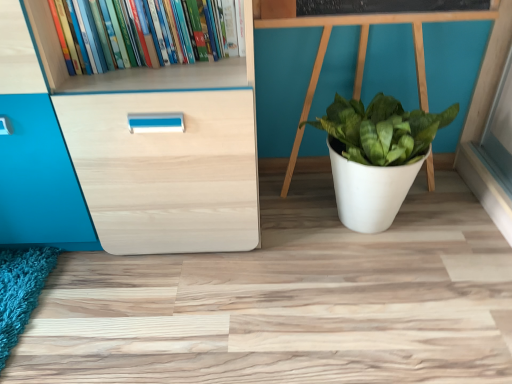
Question: Based on their positions, is white matte pot at center located to the left or right of hardcover books at upper left?

Choices:
 (A) left
 (B) right

Answer: (B)

Question: Considering the positions of white matte pot at center and hardcover books at upper left in the image, is white matte pot at center wider or thinner than hardcover books at upper left?

Choices:
 (A) thin
 (B) wide

Answer: (B)

Question: From a real-world perspective, relative to hardcover books at upper left, is white matte pot at center vertically above or below?

Choices:
 (A) above
 (B) below

Answer: (B)

Question: Based on their sizes in the image, would you say hardcover books at upper left is bigger or smaller than white matte pot at center?

Choices:
 (A) big
 (B) small

Answer: (B)

Question: Do you think hardcover books at upper left is within white matte pot at center, or outside of it?

Choices:
 (A) outside
 (B) inside

Answer: (A)

Question: From the image's perspective, is hardcover books at upper left positioned above or below white matte pot at center?

Choices:
 (A) above
 (B) below

Answer: (A)

Question: Does point (136, 56) appear closer or farther from the camera than point (390, 114)?

Choices:
 (A) closer
 (B) farther

Answer: (A)